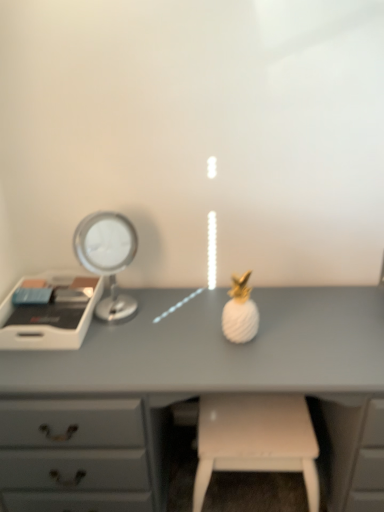
What is the approximate width of white plastic tray at left?

13.79 inches.

What do you see at coordinates (107, 257) in the screenshot? The width and height of the screenshot is (384, 512). I see `silver metallic mirror at left` at bounding box center [107, 257].

What is the approximate width of white matte stool at lower center?

The width of white matte stool at lower center is 14.76 inches.

The width and height of the screenshot is (384, 512). Identify the location of white plastic tray at left. (51, 313).

In the image, is white matte stool at lower center positioned in front of or behind matte gray desk at center?

In the image, white matte stool at lower center appears behind matte gray desk at center.

Find the location of a particular element. The image size is (384, 512). desk located on the left of white matte stool at lower center is located at coordinates (188, 395).

Is point (303, 400) closer to camera compared to point (95, 458)?

No.

From the image's perspective, is white matte stool at lower center positioned above or below matte gray desk at center?

From the image's perspective, white matte stool at lower center appears below matte gray desk at center.

Is white plastic tray at left far away from silver metallic mirror at left?

white plastic tray at left is near silver metallic mirror at left, not far away.

Consider the image. In terms of size, does white plastic tray at left appear bigger or smaller than silver metallic mirror at left?

Considering their sizes, white plastic tray at left takes up less space than silver metallic mirror at left.

Does white plastic tray at left appear on the right side of silver metallic mirror at left?

No.

Is point (55, 313) positioned after point (117, 237)?

No, it is in front of (117, 237).

In terms of size, does white matte stool at lower center appear bigger or smaller than white plastic tray at left?

Considering their sizes, white matte stool at lower center takes up more space than white plastic tray at left.

From a real-world perspective, who is located higher, white matte stool at lower center or white plastic tray at left?

From a 3D spatial view, white plastic tray at left is above.

Is white matte stool at lower center inside or outside of white plastic tray at left?

white matte stool at lower center is not enclosed by white plastic tray at left.

How far apart are white matte stool at lower center and white plastic tray at left?

The distance of white matte stool at lower center from white plastic tray at left is 24.61 inches.

Between silver metallic mirror at left and white plastic tray at left, which one has less height?

With less height is white plastic tray at left.

Is silver metallic mirror at left not near white plastic tray at left?

No, there isn't a large distance between silver metallic mirror at left and white plastic tray at left.

From a real-world perspective, is silver metallic mirror at left on top of white plastic tray at left?

Correct, in the physical world, silver metallic mirror at left is higher than white plastic tray at left.

Locate an element on the screen. The image size is (384, 512). writing desk below the silver metallic mirror at left (from a real-world perspective) is located at coordinates (51, 313).

Are silver metallic mirror at left and white matte stool at lower center located far from each other?

silver metallic mirror at left is near white matte stool at lower center, not far away.

Is white matte stool at lower center at the back of silver metallic mirror at left?

No, silver metallic mirror at left is not facing the opposite direction of white matte stool at lower center.

How many degrees apart are the facing directions of silver metallic mirror at left and white matte stool at lower center?

The angle between the facing direction of silver metallic mirror at left and the facing direction of white matte stool at lower center is 32.6 degrees.

Is point (124, 230) farther from viewer compared to point (254, 401)?

Yes, it is.

From the image's perspective, is silver metallic mirror at left positioned above or below matte gray desk at center?

From the image's perspective, silver metallic mirror at left appears above matte gray desk at center.

Considering the positions of point (101, 274) and point (282, 383), is point (101, 274) closer or farther from the camera than point (282, 383)?

Point (101, 274).

Is silver metallic mirror at left looking in the opposite direction of matte gray desk at center?

No.

Between silver metallic mirror at left and matte gray desk at center, which one is positioned behind?

silver metallic mirror at left is more distant.

In the image, there is a silver metallic mirror at left. Identify the location of desk below it (from a real-world perspective). This screenshot has height=512, width=384. (188, 395).

Considering the relative positions of matte gray desk at center and silver metallic mirror at left in the image provided, is matte gray desk at center to the left of silver metallic mirror at left from the viewer's perspective?

No, matte gray desk at center is not to the left of silver metallic mirror at left.

Where is `stool that is under the matte gray desk at center (from a real-world perspective)`? The image size is (384, 512). stool that is under the matte gray desk at center (from a real-world perspective) is located at coordinates (256, 439).

Find the location of `bedside lamp above the white plastic tray at left (from the image's perspective)`. bedside lamp above the white plastic tray at left (from the image's perspective) is located at coordinates (107, 257).

From the image, which object appears to be nearer to white matte stool at lower center, white plastic tray at left or matte gray desk at center?

Among the two, matte gray desk at center is located nearer to white matte stool at lower center.

Which object lies further to the anchor point matte gray desk at center, white plastic tray at left or white matte stool at lower center?

Based on the image, white plastic tray at left appears to be further to matte gray desk at center.

From the image, which object appears to be farther from silver metallic mirror at left, white plastic tray at left or matte gray desk at center?

Based on the image, matte gray desk at center appears to be further to silver metallic mirror at left.

Which object lies nearer to the anchor point white matte stool at lower center, white plastic tray at left or silver metallic mirror at left?

silver metallic mirror at left.

When comparing their distances from matte gray desk at center, does silver metallic mirror at left or white plastic tray at left seem further?

silver metallic mirror at left.

When comparing their distances from matte gray desk at center, does white plastic tray at left or silver metallic mirror at left seem closer?

white plastic tray at left lies closer to matte gray desk at center than the other object.

Which object lies nearer to the anchor point matte gray desk at center, white matte stool at lower center or white plastic tray at left?

The object closer to matte gray desk at center is white matte stool at lower center.

Considering their positions, is silver metallic mirror at left positioned closer to white matte stool at lower center than white plastic tray at left?

silver metallic mirror at left lies closer to white matte stool at lower center than the other object.

Locate an element on the screen. desk between silver metallic mirror at left and white matte stool at lower center from top to bottom is located at coordinates tap(188, 395).

Find the location of a particular element. The height and width of the screenshot is (512, 384). writing desk that lies between silver metallic mirror at left and white matte stool at lower center from top to bottom is located at coordinates (51, 313).

The height and width of the screenshot is (512, 384). In order to click on bedside lamp between white plastic tray at left and matte gray desk at center from left to right in this screenshot , I will do `click(107, 257)`.

The width and height of the screenshot is (384, 512). In order to click on desk between white plastic tray at left and white matte stool at lower center in this screenshot , I will do pyautogui.click(x=188, y=395).